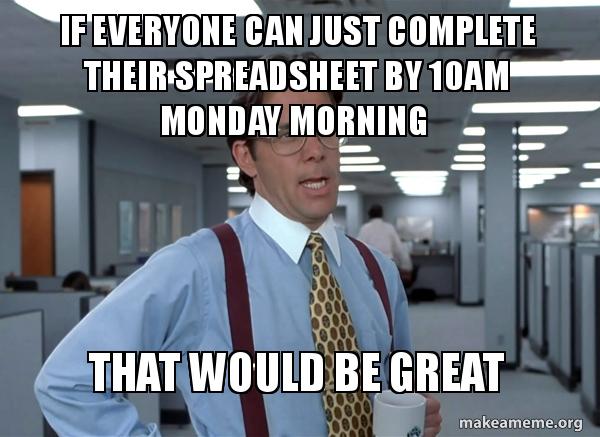
Where is `offices`? The height and width of the screenshot is (437, 600). offices is located at coordinates (32, 332).